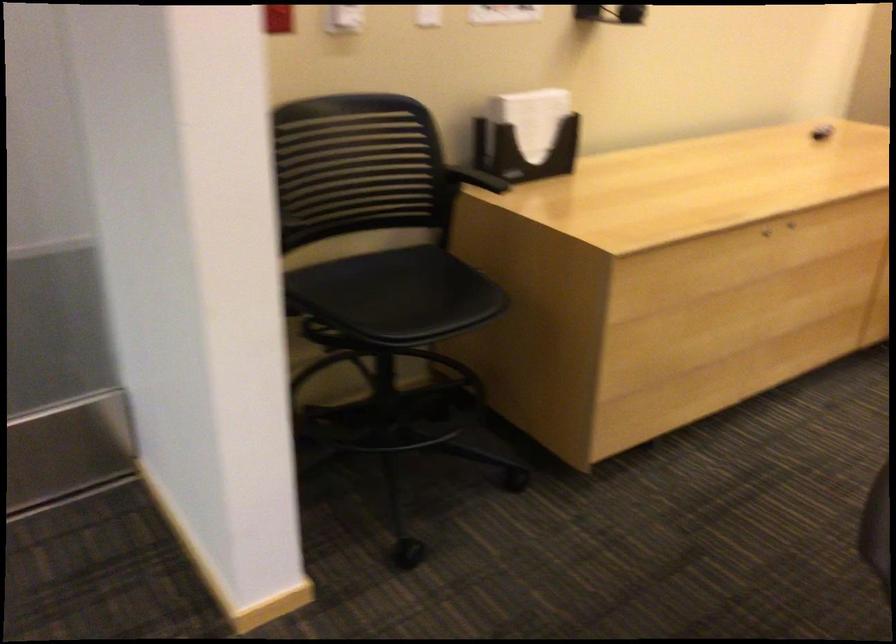
What do you see at coordinates (475, 178) in the screenshot? Image resolution: width=896 pixels, height=644 pixels. I see `the chair armrest` at bounding box center [475, 178].